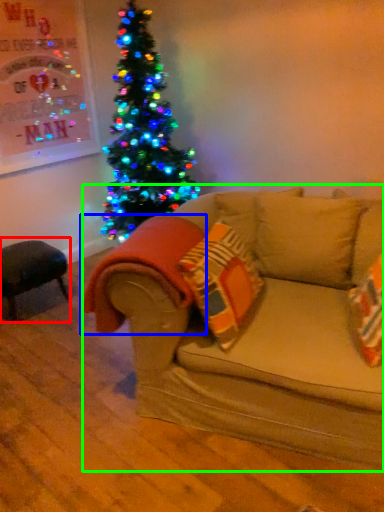
Question: Which object is positioned farthest from swivel chair (highlighted by a red box)? Select from blanket (highlighted by a blue box) and studio couch (highlighted by a green box).

Choices:
 (A) blanket
 (B) studio couch

Answer: (B)